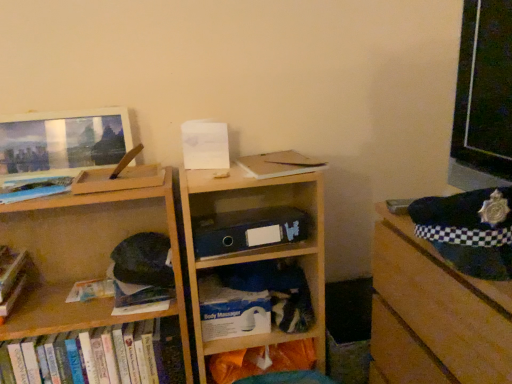
Question: From a real-world perspective, is hardcover books at lower left, the 1th book positioned from the bottom, physically below wooden bookshelf at center?

Choices:
 (A) no
 (B) yes

Answer: (B)

Question: Is wooden bookshelf at center located within hardcover books at lower left, the 1th book positioned from the bottom?

Choices:
 (A) no
 (B) yes

Answer: (A)

Question: Is hardcover books at lower left, arranged as the 2th book when viewed from the top, touching wooden bookshelf at center?

Choices:
 (A) no
 (B) yes

Answer: (A)

Question: From the image's perspective, would you say hardcover books at lower left, the 1th book positioned from the bottom, is shown under wooden bookshelf at center?

Choices:
 (A) no
 (B) yes

Answer: (B)

Question: Considering the relative sizes of hardcover books at lower left, arranged as the 2th book when viewed from the top, and wooden bookshelf at center in the image provided, is hardcover books at lower left, arranged as the 2th book when viewed from the top, bigger than wooden bookshelf at center?

Choices:
 (A) yes
 (B) no

Answer: (B)

Question: From a real-world perspective, is hardcover books at lower left, arranged as the 2th book when viewed from the top, over wooden bookshelf at center?

Choices:
 (A) no
 (B) yes

Answer: (A)

Question: Is black checkered fabric at right positioned with its back to matte blue book at left, which appears as the 1th book when viewed from the top?

Choices:
 (A) yes
 (B) no

Answer: (B)

Question: From a real-world perspective, is black checkered fabric at right located beneath matte blue book at left, arranged as the second book when ordered from the bottom?

Choices:
 (A) no
 (B) yes

Answer: (B)

Question: Is black checkered fabric at right not within matte blue book at left, which appears as the 1th book when viewed from the top?

Choices:
 (A) yes
 (B) no

Answer: (A)

Question: Is matte blue book at left, arranged as the second book when ordered from the bottom, a part of black checkered fabric at right?

Choices:
 (A) yes
 (B) no

Answer: (B)

Question: Is there a large distance between black checkered fabric at right and matte blue book at left, arranged as the second book when ordered from the bottom?

Choices:
 (A) yes
 (B) no

Answer: (B)

Question: From the image's perspective, is black checkered fabric at right beneath matte blue book at left, which appears as the 1th book when viewed from the top?

Choices:
 (A) yes
 (B) no

Answer: (A)

Question: From a real-world perspective, is hardcover books at lower left, arranged as the 2th book when viewed from the top, physically below white matte paperback book at center?

Choices:
 (A) yes
 (B) no

Answer: (A)